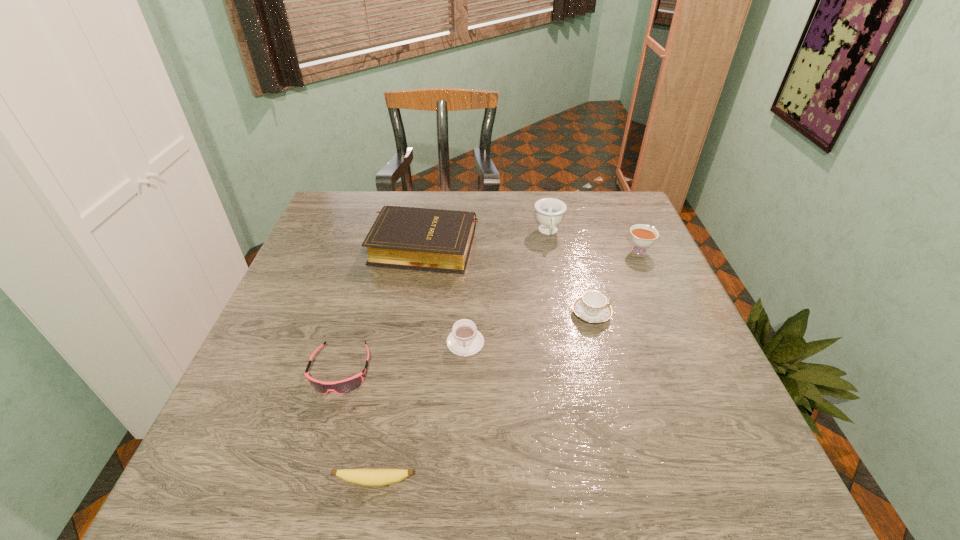
Select which teacup appears as the closest to the nearest teacup. Please provide its 2D coordinates. Your answer should be formatted as a tuple, i.e. [(x, y)], where the tuple contains the x and y coordinates of a point satisfying the conditions above.

[(592, 307)]

The width and height of the screenshot is (960, 540). Identify the location of free spot that satisfies the following two spatial constraints: 1. on the back side of the banana; 2. on the right side of the Bible. (418, 246).

This screenshot has width=960, height=540. I want to click on vacant space that satisfies the following two spatial constraints: 1. on the side with the handle of the fourth nearest object; 2. on the handle side of the leftmost teacup, so click(599, 342).

Where is `free location that satisfies the following two spatial constraints: 1. on the front-facing side of the goggles; 2. on the left side of the nearest object`? The height and width of the screenshot is (540, 960). free location that satisfies the following two spatial constraints: 1. on the front-facing side of the goggles; 2. on the left side of the nearest object is located at coordinates (308, 482).